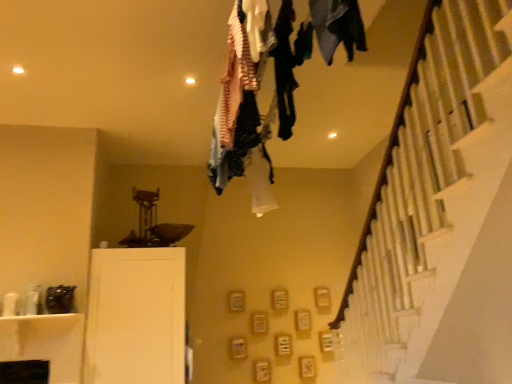
Question: In the image, is white matte cabinet at lower left positioned in front of or behind dark blue fabric at upper center?

Choices:
 (A) behind
 (B) front

Answer: (A)

Question: Is point (129, 354) closer or farther from the camera than point (346, 8)?

Choices:
 (A) closer
 (B) farther

Answer: (B)

Question: Would you say white matte cabinet at lower left is to the left or to the right of dark blue fabric at upper center in the picture?

Choices:
 (A) right
 (B) left

Answer: (B)

Question: Considering their positions, is dark blue fabric at upper center located in front of or behind white matte cabinet at lower left?

Choices:
 (A) front
 (B) behind

Answer: (A)

Question: Is dark blue fabric at upper center taller or shorter than white matte cabinet at lower left?

Choices:
 (A) short
 (B) tall

Answer: (A)

Question: Considering the positions of point (357, 39) and point (136, 314), is point (357, 39) closer or farther from the camera than point (136, 314)?

Choices:
 (A) closer
 (B) farther

Answer: (A)

Question: From a real-world perspective, is dark blue fabric at upper center positioned above or below white matte cabinet at lower left?

Choices:
 (A) below
 (B) above

Answer: (B)